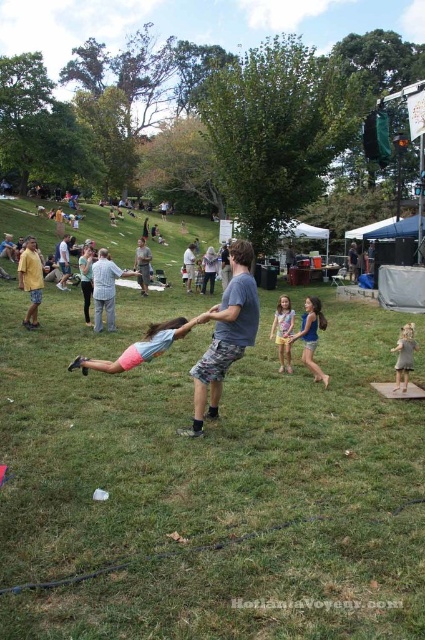
Question: Which point appears farthest from the camera in this image?

Choices:
 (A) (76, 397)
 (B) (224, 355)
 (C) (108, 268)

Answer: (C)

Question: Does light gray shirt at center appear under gray camouflage shorts at center?

Choices:
 (A) yes
 (B) no

Answer: (A)

Question: Where is gray cotton t-shirt at center located in relation to light gray shirt at center in the image?

Choices:
 (A) right
 (B) left

Answer: (A)

Question: Is green grass at center below light blue denim jeans at center?

Choices:
 (A) no
 (B) yes

Answer: (B)

Question: Among these objects, which one is nearest to the camera?

Choices:
 (A) light blue denim jeans at center
 (B) gray cotton dress at lower right

Answer: (B)

Question: Which of the following is the closest to the observer?

Choices:
 (A) (218, 355)
 (B) (113, 314)
 (C) (147, 244)
 (D) (305, 348)

Answer: (A)